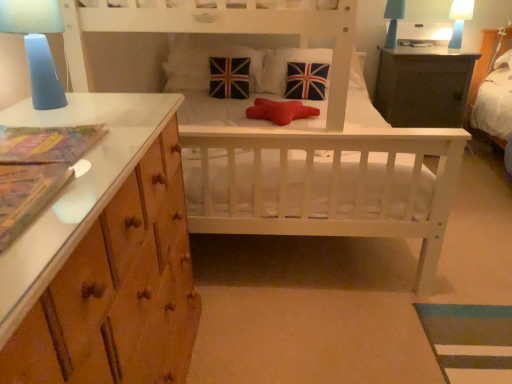
Question: Is velvet union jack pillow at center, which is counted as the fourth pillow, starting from the right, not within blue matte lampshade at upper right, the 3th bedside lamp viewed from the front?

Choices:
 (A) yes
 (B) no

Answer: (A)

Question: Is velvet union jack pillow at center, which is counted as the fourth pillow, starting from the right, closer to camera compared to blue matte lampshade at upper right, marked as the 2th bedside lamp in a right-to-left arrangement?

Choices:
 (A) yes
 (B) no

Answer: (A)

Question: From the image's perspective, is velvet union jack pillow at center, which is counted as the fourth pillow, starting from the right, above blue matte lampshade at upper right, which is the 1th bedside lamp in back-to-front order?

Choices:
 (A) no
 (B) yes

Answer: (A)

Question: Is velvet union jack pillow at center, which is counted as the fourth pillow, starting from the right, with blue matte lampshade at upper right, which is the 1th bedside lamp in back-to-front order?

Choices:
 (A) yes
 (B) no

Answer: (B)

Question: Is velvet union jack pillow at center, which appears as the 1th pillow when viewed from the left, taller than blue matte lampshade at upper right, the 1th bedside lamp in the top-to-bottom sequence?

Choices:
 (A) yes
 (B) no

Answer: (A)

Question: Is velvet union jack pillow at center, which is counted as the fourth pillow, starting from the right, far away from blue matte lampshade at upper right, which is the 1th bedside lamp in back-to-front order?

Choices:
 (A) yes
 (B) no

Answer: (A)

Question: Considering the relative sizes of union jack fabric pillow at center, which is the first pillow from right to left, and velvet union jack pillow at center, which is counted as the third pillow, starting from the right, in the image provided, is union jack fabric pillow at center, which is the first pillow from right to left, smaller than velvet union jack pillow at center, which is counted as the third pillow, starting from the right,?

Choices:
 (A) yes
 (B) no

Answer: (B)

Question: From the image's perspective, would you say union jack fabric pillow at center, which appears as the 4th pillow when viewed from the left, is positioned over velvet union jack pillow at center, which is the 2th pillow in left-to-right order?

Choices:
 (A) no
 (B) yes

Answer: (B)

Question: Is union jack fabric pillow at center, which is the first pillow from right to left, directly adjacent to velvet union jack pillow at center, which is the 2th pillow in left-to-right order?

Choices:
 (A) yes
 (B) no

Answer: (B)

Question: Are union jack fabric pillow at center, which appears as the 4th pillow when viewed from the left, and velvet union jack pillow at center, which is the 2th pillow in left-to-right order, located far from each other?

Choices:
 (A) no
 (B) yes

Answer: (A)

Question: From a real-world perspective, does union jack fabric pillow at center, which appears as the 4th pillow when viewed from the left, stand above velvet union jack pillow at center, which is the 2th pillow in left-to-right order?

Choices:
 (A) yes
 (B) no

Answer: (A)

Question: Could you tell me if union jack fabric pillow at center, which appears as the 4th pillow when viewed from the left, is turned towards velvet union jack pillow at center, which is counted as the third pillow, starting from the right?

Choices:
 (A) no
 (B) yes

Answer: (A)

Question: From the image's perspective, is dark gray wooden table at upper right beneath blue frosted glass lamp at upper left, the third bedside lamp positioned from the right?

Choices:
 (A) no
 (B) yes

Answer: (A)